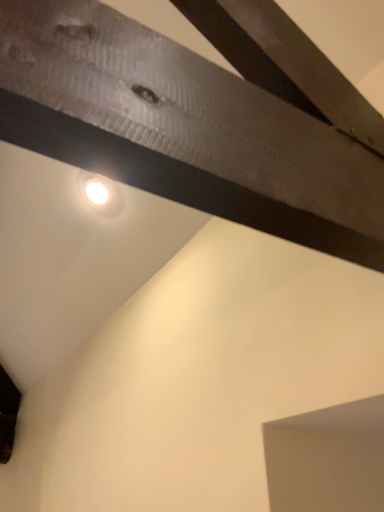
In order to face white glossy droplight at upper left, should I rotate leftwards or rightwards?

Turn left approximately 12.777 degrees to face it.

Image resolution: width=384 pixels, height=512 pixels. What do you see at coordinates (100, 194) in the screenshot?
I see `white glossy droplight at upper left` at bounding box center [100, 194].

Find the location of a particular element. The width and height of the screenshot is (384, 512). white glossy droplight at upper left is located at coordinates (100, 194).

Locate an element on the screen. The image size is (384, 512). white glossy droplight at upper left is located at coordinates (100, 194).